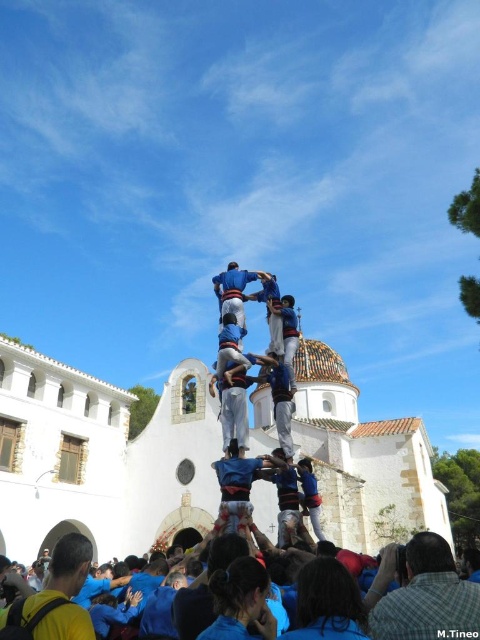
Question: Which point appears farthest from the camera in this image?

Choices:
 (A) (440, 632)
 (B) (466, 588)
 (C) (66, 618)

Answer: (B)

Question: Does blue shirt at lower center come behind yellow shirt at lower left?

Choices:
 (A) no
 (B) yes

Answer: (B)

Question: Among these objects, which one is farthest from the camera?

Choices:
 (A) blue fabric crowd at lower center
 (B) blue shirt at lower center
 (C) yellow shirt at lower left

Answer: (B)

Question: Does blue fabric crowd at lower center appear over yellow shirt at lower left?

Choices:
 (A) yes
 (B) no

Answer: (B)

Question: Considering the relative positions of blue shirt at lower center and blue fabric crowd at lower center in the image provided, where is blue shirt at lower center located with respect to blue fabric crowd at lower center?

Choices:
 (A) right
 (B) left

Answer: (A)

Question: Estimate the real-world distances between objects in this image. Which object is farther from the yellow shirt at lower left?

Choices:
 (A) blue shirt at lower center
 (B) blue fabric crowd at lower center

Answer: (A)